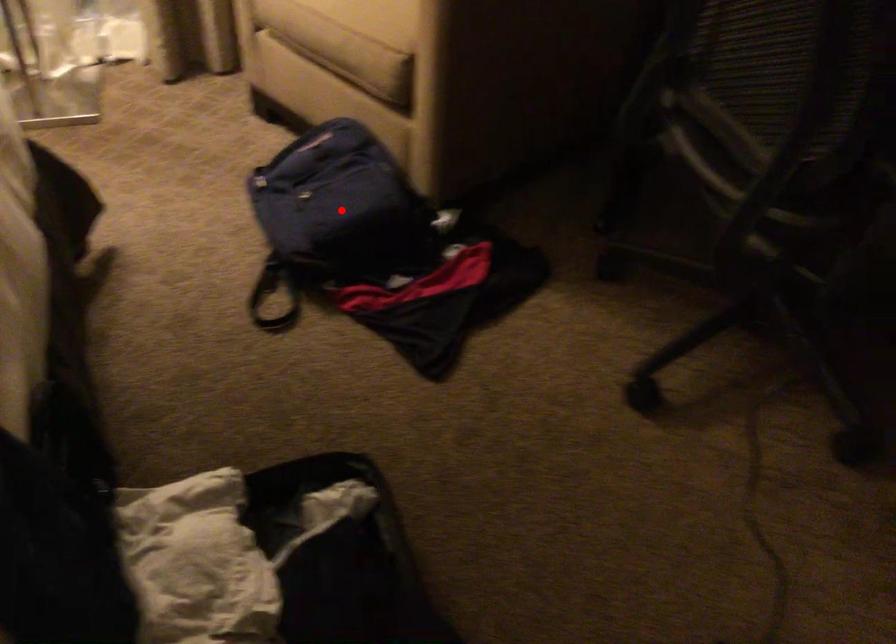
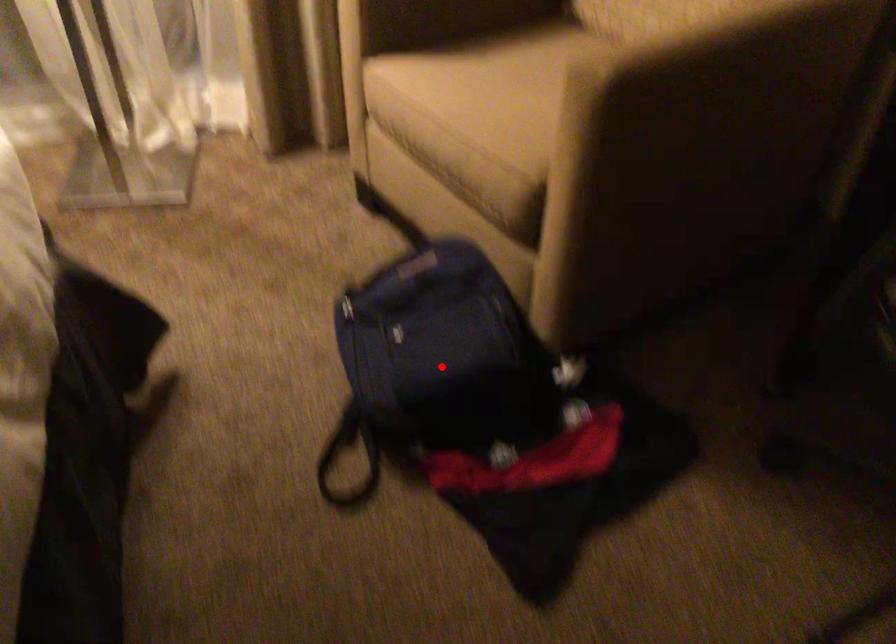
I am providing you with two images of the same scene from different viewpoints. A red point is marked on the first image and another point is marked on the second image. Does the point marked in image1 correspond to the same location as the one in image2?

Yes